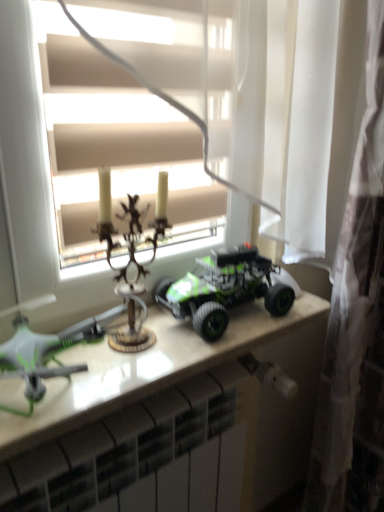
You are a GUI agent. You are given a task and a screenshot of the screen. Output one action in this format:
    pyautogui.click(x=<x>, y=<y>)
    Task: Click on the vacant area that lies between antique brass candlestick at center, marked as the 2th toy in a left-to-right arrangement, and green matte drone at left, which ranks as the third toy in right-to-left order
    
    Given the screenshot: What is the action you would take?
    pyautogui.click(x=155, y=358)